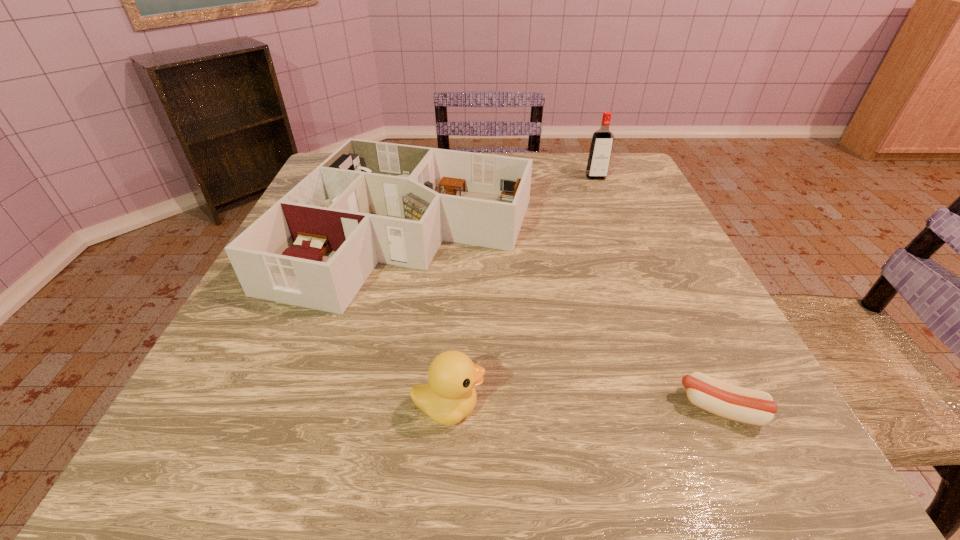
Where is `vodka`? The height and width of the screenshot is (540, 960). vodka is located at coordinates (601, 146).

Locate an element on the screen. This screenshot has height=540, width=960. dollhouse is located at coordinates (369, 202).

The image size is (960, 540). I want to click on duck, so click(x=449, y=396).

Where is `sausage`? sausage is located at coordinates (741, 404).

Image resolution: width=960 pixels, height=540 pixels. I want to click on vacant space situated 0.210m on the front and back of the vodka, so click(x=615, y=225).

Image resolution: width=960 pixels, height=540 pixels. I want to click on free space located on the front of the dollhouse, so click(x=380, y=368).

You are a GUI agent. You are given a task and a screenshot of the screen. Output one action in this format:
    pyautogui.click(x=<x>, y=<y>)
    Task: Click on the blank space located 0.100m on the face of the duck
    
    Given the screenshot: What is the action you would take?
    pyautogui.click(x=552, y=407)

Identify the location of vacant position located on the back of the sausage. The image size is (960, 540). (674, 308).

You are a GUI agent. You are given a task and a screenshot of the screen. Output one action in this format:
    pyautogui.click(x=<x>, y=<y>)
    Task: Click on the vodka at the far edge
    
    Given the screenshot: What is the action you would take?
    pyautogui.click(x=601, y=146)

Identify the location of dollhouse situated at the far edge. (369, 202).